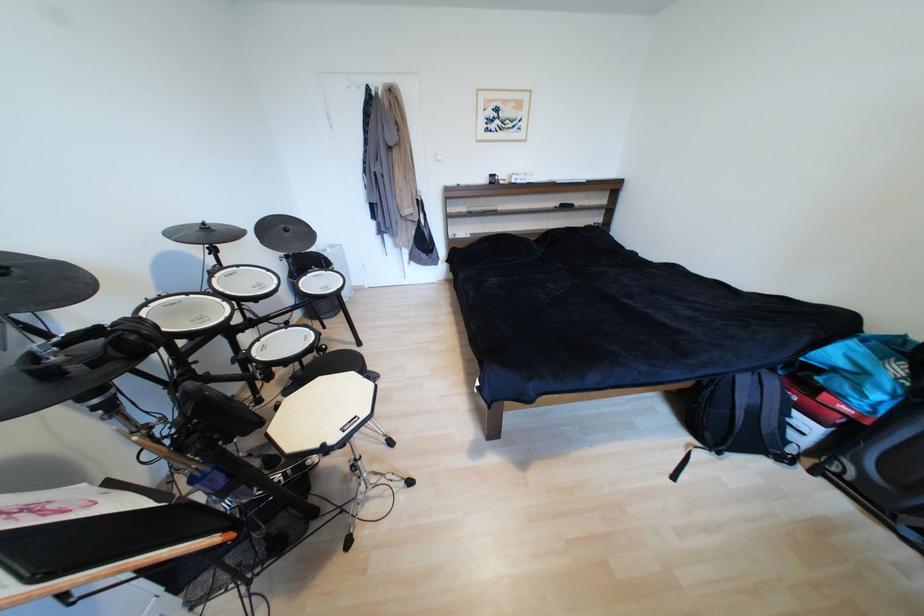
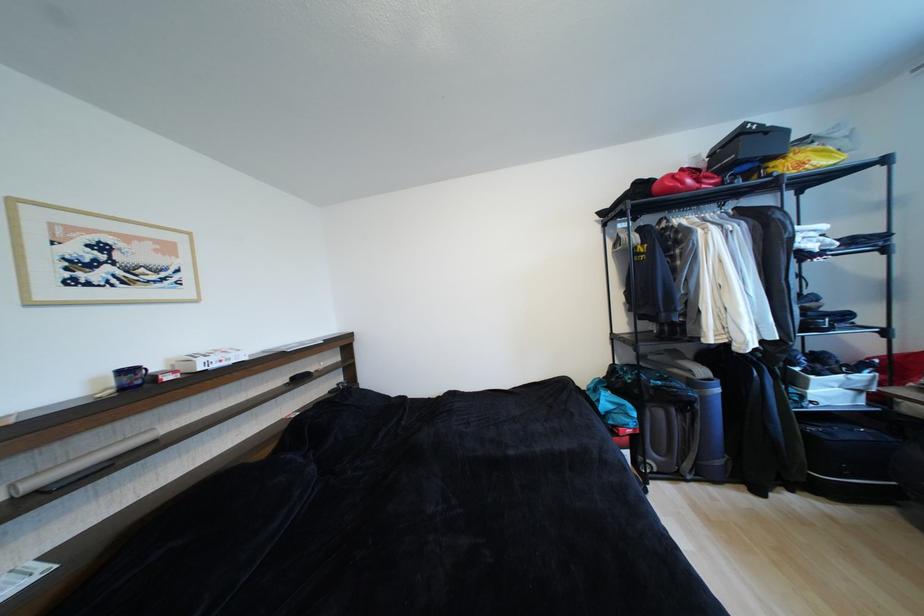
The point at [477,211] is marked in the first image. Where is the corresponding point in the second image?

(40, 485)